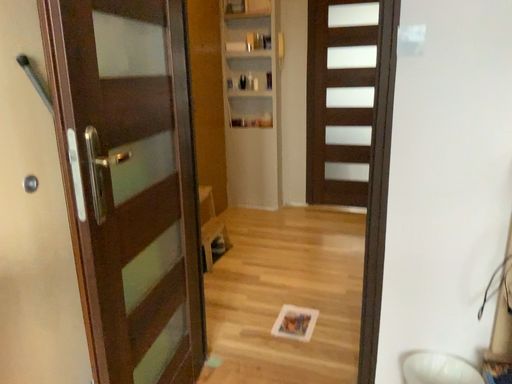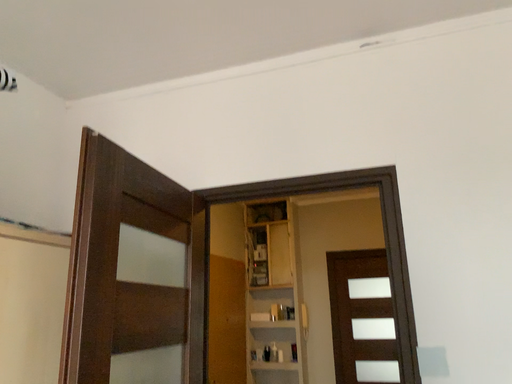
Question: How did the camera likely rotate when shooting the video?

Choices:
 (A) rotated downward
 (B) rotated upward

Answer: (B)